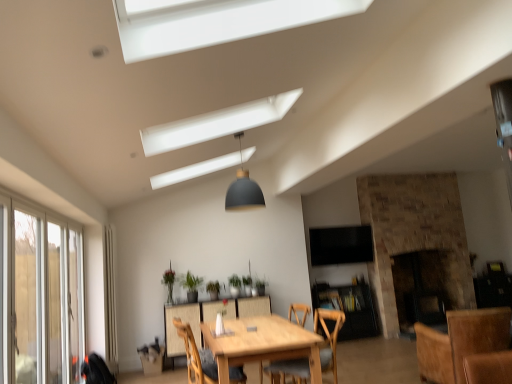
Question: Which direction should I rotate to look at green matte plant at center, marked as the second plant in a left-to-right arrangement, — up or down?

Choices:
 (A) up
 (B) down

Answer: (B)

Question: Is black glass fireplace at center, the 2th fireplace positioned from the left, turned away from matte gray dome at center?

Choices:
 (A) yes
 (B) no

Answer: (B)

Question: Considering the relative sizes of black glass fireplace at center, the 2th fireplace positioned from the left, and matte gray dome at center in the image provided, is black glass fireplace at center, the 2th fireplace positioned from the left, taller than matte gray dome at center?

Choices:
 (A) yes
 (B) no

Answer: (A)

Question: From a real-world perspective, does black glass fireplace at center, the 2th fireplace positioned from the left, stand above matte gray dome at center?

Choices:
 (A) no
 (B) yes

Answer: (A)

Question: Is black glass fireplace at center, the 2th fireplace positioned from the left, positioned beyond the bounds of matte gray dome at center?

Choices:
 (A) no
 (B) yes

Answer: (B)

Question: Would you consider black glass fireplace at center, the 2th fireplace positioned from the left, to be distant from matte gray dome at center?

Choices:
 (A) no
 (B) yes

Answer: (B)

Question: Is black glass fireplace at center, the 2th fireplace positioned from the left, closer to camera compared to matte gray dome at center?

Choices:
 (A) yes
 (B) no

Answer: (B)

Question: Does wooden chair at center, placed as the 2th chair when sorted from right to left, have a larger size compared to brick fireplace at right, the 2th fireplace viewed from the right?

Choices:
 (A) no
 (B) yes

Answer: (A)

Question: Does wooden chair at center, placed as the 2th chair when sorted from right to left, have a greater width compared to brick fireplace at right, which is the 1th fireplace from left to right?

Choices:
 (A) no
 (B) yes

Answer: (A)

Question: From the image's perspective, does wooden chair at center, placed as the 2th chair when sorted from right to left, appear lower than brick fireplace at right, the 2th fireplace viewed from the right?

Choices:
 (A) no
 (B) yes

Answer: (B)

Question: Can you confirm if wooden chair at center, the 2th chair when ordered from left to right, is shorter than brick fireplace at right, the 2th fireplace viewed from the right?

Choices:
 (A) no
 (B) yes

Answer: (B)

Question: Is wooden chair at center, placed as the 2th chair when sorted from right to left, turned away from brick fireplace at right, the 2th fireplace viewed from the right?

Choices:
 (A) yes
 (B) no

Answer: (B)

Question: Is wooden chair at center, placed as the 2th chair when sorted from right to left, not near brick fireplace at right, the 2th fireplace viewed from the right?

Choices:
 (A) no
 (B) yes

Answer: (B)

Question: Considering the relative sizes of green matte plant at center, which is the fourth plant from left to right, and green matte plant at center, marked as the second plant in a left-to-right arrangement, in the image provided, is green matte plant at center, which is the fourth plant from left to right, wider than green matte plant at center, marked as the second plant in a left-to-right arrangement,?

Choices:
 (A) no
 (B) yes

Answer: (A)